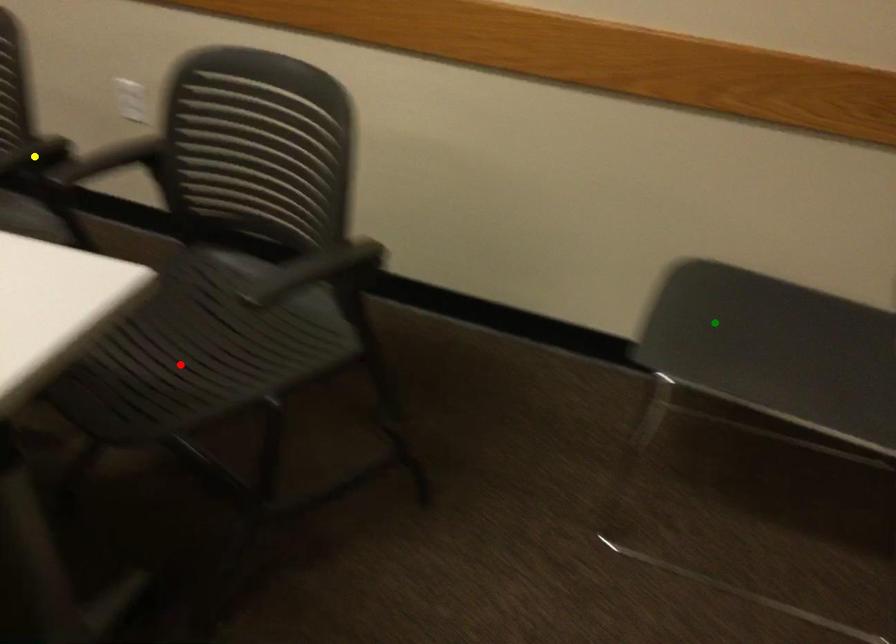
Order these from nearest to farthest:
- red point
- green point
- yellow point

green point, yellow point, red point